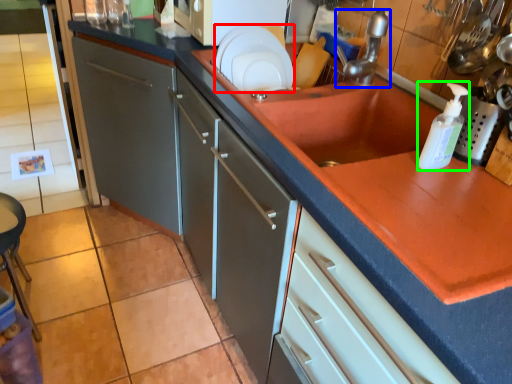
Question: Which object is the closest to the plate (highlighted by a red box)? Choose among these: tap (highlighted by a blue box) or bottle (highlighted by a green box).

Choices:
 (A) tap
 (B) bottle

Answer: (A)